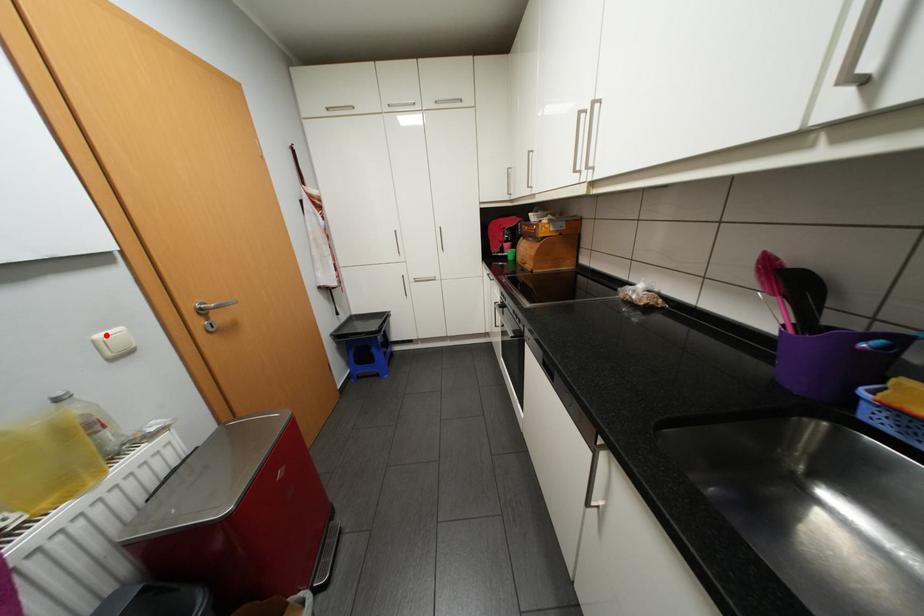
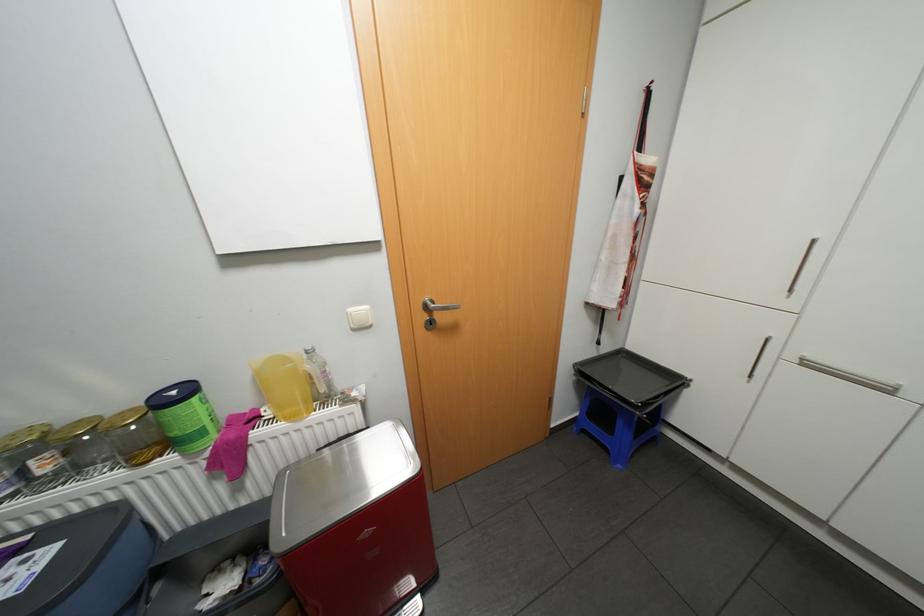
Find the pixel in the second image that matches the highlighted location in the first image.

(358, 309)